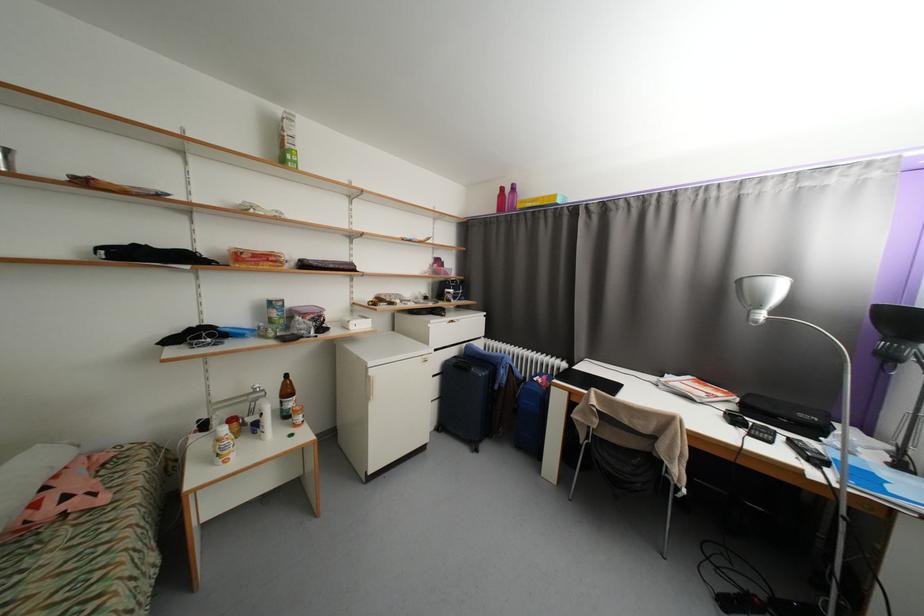
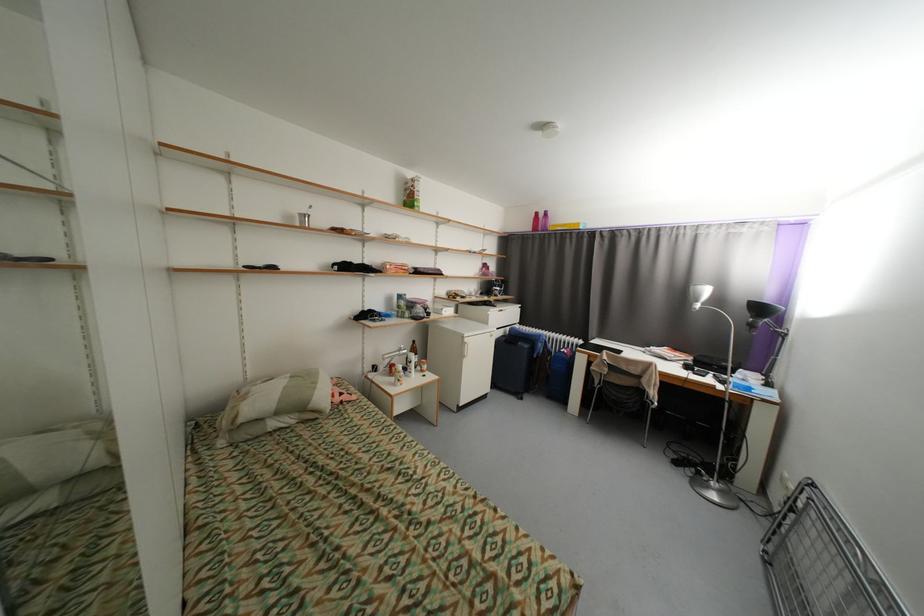
The point at (378, 373) is marked in the first image. Where is the corresponding point in the second image?

(472, 341)